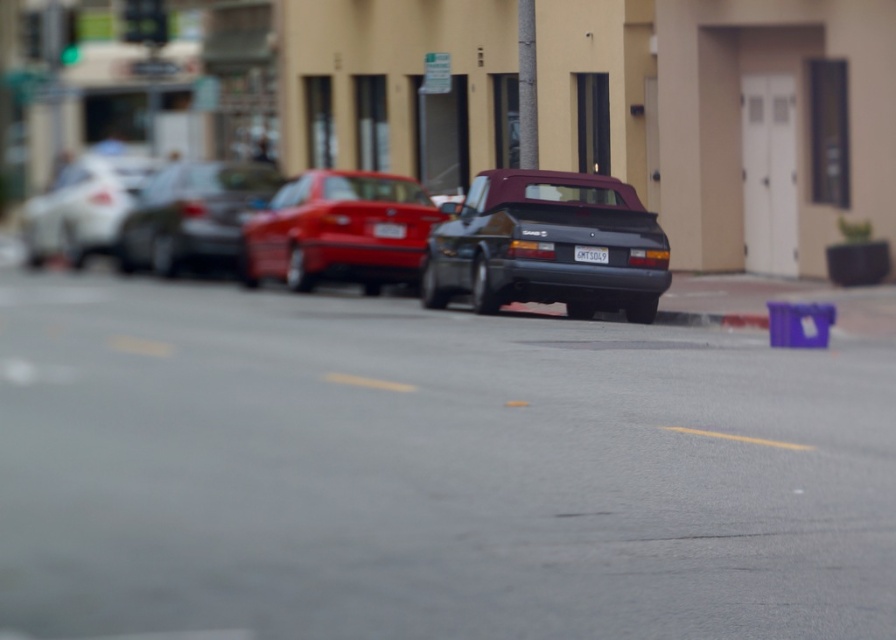
Does shiny silver sedan at center have a greater height compared to white plastic license plate at center?

Correct, shiny silver sedan at center is much taller as white plastic license plate at center.

Between point (185, 244) and point (573, 257), which one is positioned in front?

Point (573, 257) is more forward.

The image size is (896, 640). Identify the location of shiny silver sedan at center. (192, 216).

Who is taller, shiny silver sedan at center or white glossy sedan at left?

With more height is white glossy sedan at left.

Does shiny silver sedan at center have a lesser width compared to white glossy sedan at left?

Indeed, shiny silver sedan at center has a lesser width compared to white glossy sedan at left.

The height and width of the screenshot is (640, 896). Describe the element at coordinates (192, 216) in the screenshot. I see `shiny silver sedan at center` at that location.

You are a GUI agent. You are given a task and a screenshot of the screen. Output one action in this format:
    pyautogui.click(x=<x>, y=<y>)
    Task: Click on the shiny silver sedan at center
    This screenshot has height=640, width=896.
    Given the screenshot: What is the action you would take?
    pyautogui.click(x=192, y=216)

Is satin black convertible at center wider than white glossy sedan at left?

Incorrect, satin black convertible at center's width does not surpass white glossy sedan at left's.

Which of these two, satin black convertible at center or white glossy sedan at left, stands taller?

white glossy sedan at left is taller.

The height and width of the screenshot is (640, 896). Describe the element at coordinates (547, 244) in the screenshot. I see `satin black convertible at center` at that location.

Find the location of a particular element. The width and height of the screenshot is (896, 640). satin black convertible at center is located at coordinates (547, 244).